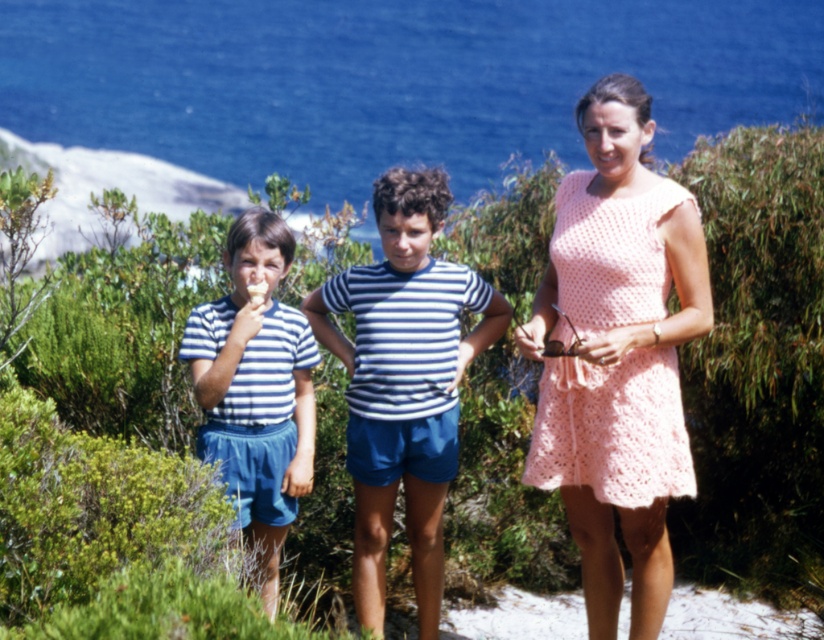
Identify the location of blue striped shirt at center. (405, 381).

Between point (414, 422) and point (288, 314), which one is positioned in front?

Point (288, 314)

Where is `blue striped shirt at center`? The width and height of the screenshot is (824, 640). blue striped shirt at center is located at coordinates (405, 381).

Which is more to the right, pink crochet dress at center or blue striped shirt at left?

pink crochet dress at center is more to the right.

Is the position of pink crochet dress at center less distant than that of blue striped shirt at left?

No, pink crochet dress at center is further to the viewer.

This screenshot has height=640, width=824. What do you see at coordinates (618, 355) in the screenshot? I see `pink crochet dress at center` at bounding box center [618, 355].

What are the coordinates of `pink crochet dress at center` in the screenshot? It's located at (618, 355).

From the picture: Does pink crochet dress at center have a lesser width compared to blue striped shirt at center?

Yes.

Image resolution: width=824 pixels, height=640 pixels. Describe the element at coordinates (618, 355) in the screenshot. I see `pink crochet dress at center` at that location.

Does point (654, 502) come closer to viewer compared to point (436, 566)?

Yes, it is in front of point (436, 566).

What are the coordinates of `pink crochet dress at center` in the screenshot? It's located at (618, 355).